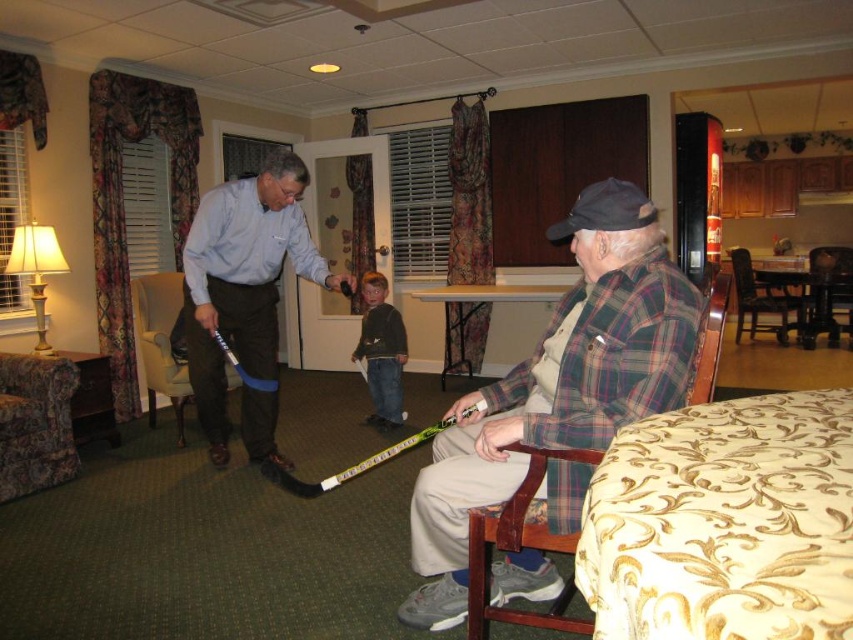
Question: Does wooden armchair at left appear under dark gray fleece jacket at center?

Choices:
 (A) yes
 (B) no

Answer: (A)

Question: Which point is farther from the camera taking this photo?

Choices:
 (A) (525, 529)
 (B) (396, 408)
 (C) (763, 304)
 (D) (207, 406)

Answer: (C)

Question: Which point is closer to the camera?

Choices:
 (A) wooden armchair at lower center
 (B) wooden chair at right

Answer: (A)

Question: Among these objects, which one is nearest to the camera?

Choices:
 (A) wooden armchair at lower center
 (B) brown wooden chair at right
 (C) light blue shirt at center
 (D) wooden chair at right

Answer: (A)

Question: Considering the relative positions of dark gray fleece jacket at center and brown wooden chair at right in the image provided, where is dark gray fleece jacket at center located with respect to brown wooden chair at right?

Choices:
 (A) below
 (B) above

Answer: (A)

Question: Is floral fabric armchair at lower left thinner than wooden armchair at left?

Choices:
 (A) yes
 (B) no

Answer: (A)